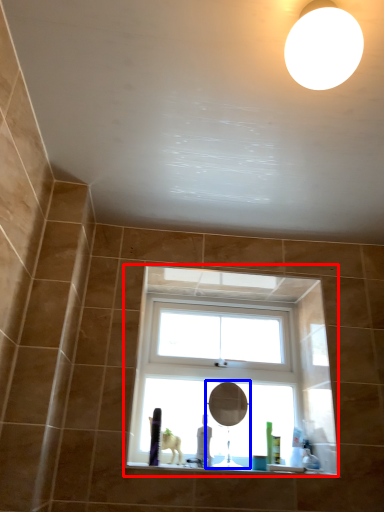
Question: Which of the following is the farthest to the observer, window (highlighted by a red box) or mirror (highlighted by a blue box)?

Choices:
 (A) window
 (B) mirror

Answer: (A)